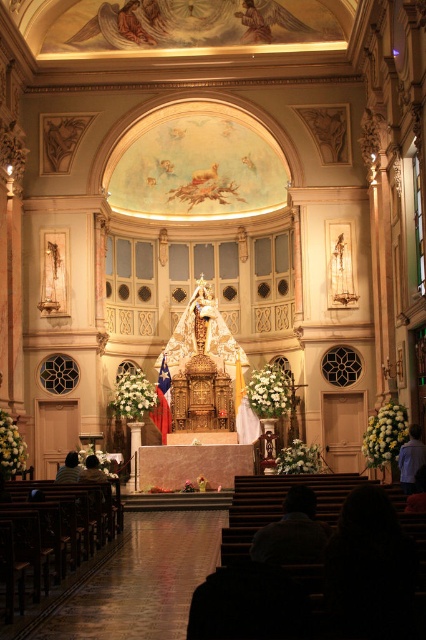
Question: Which of the following is the closest to the observer?

Choices:
 (A) blue fabric shirt at lower right
 (B) dark brown hair at lower left

Answer: (B)

Question: Can you confirm if blue fabric shirt at lower right is bigger than dark brown hair at lower left?

Choices:
 (A) no
 (B) yes

Answer: (A)

Question: Which object appears farthest from the camera in this image?

Choices:
 (A) dark brown hair at lower left
 (B) dark brown leather jacket at lower left
 (C) blue fabric shirt at lower right

Answer: (C)

Question: Which object is the farthest from the blue fabric shirt at lower right?

Choices:
 (A) dark brown hair at lower left
 (B) dark brown leather jacket at lower left

Answer: (B)

Question: Is the position of dark brown leather jacket at lower left more distant than that of dark brown hair at lower left?

Choices:
 (A) no
 (B) yes

Answer: (B)

Question: Is blue fabric shirt at lower right below dark brown leather jacket at lower left?

Choices:
 (A) no
 (B) yes

Answer: (A)